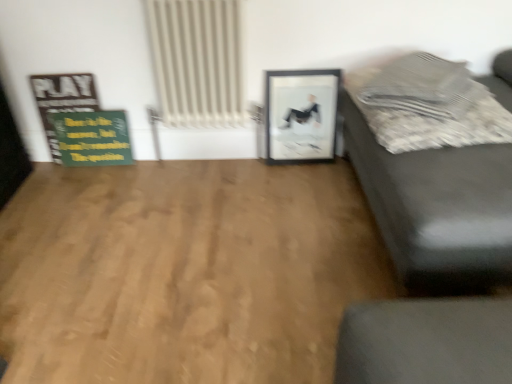
Question: Does matte black couch at right have a larger size compared to white textured radiator at upper center?

Choices:
 (A) yes
 (B) no

Answer: (A)

Question: Is matte black couch at right aimed at white textured radiator at upper center?

Choices:
 (A) no
 (B) yes

Answer: (B)

Question: From a real-world perspective, is matte black couch at right on top of white textured radiator at upper center?

Choices:
 (A) yes
 (B) no

Answer: (A)

Question: Does matte black couch at right have a greater width compared to white textured radiator at upper center?

Choices:
 (A) yes
 (B) no

Answer: (A)

Question: Does matte black couch at right have a lesser height compared to white textured radiator at upper center?

Choices:
 (A) no
 (B) yes

Answer: (A)

Question: Considering the positions of natural wood floor at center and wooden signboard at left in the image, is natural wood floor at center taller or shorter than wooden signboard at left?

Choices:
 (A) short
 (B) tall

Answer: (A)

Question: Is natural wood floor at center in front of or behind wooden signboard at left in the image?

Choices:
 (A) behind
 (B) front

Answer: (B)

Question: Is natural wood floor at center bigger or smaller than wooden signboard at left?

Choices:
 (A) big
 (B) small

Answer: (A)

Question: From the image's perspective, is natural wood floor at center above or below wooden signboard at left?

Choices:
 (A) above
 (B) below

Answer: (B)

Question: From a real-world perspective, is matte black couch at right physically located above or below wooden signboard at left?

Choices:
 (A) above
 (B) below

Answer: (A)

Question: Considering the relative positions of matte black couch at right and wooden signboard at left in the image provided, is matte black couch at right to the left or to the right of wooden signboard at left?

Choices:
 (A) right
 (B) left

Answer: (A)

Question: In terms of width, does matte black couch at right look wider or thinner when compared to wooden signboard at left?

Choices:
 (A) wide
 (B) thin

Answer: (A)

Question: Is matte black couch at right bigger or smaller than wooden signboard at left?

Choices:
 (A) small
 (B) big

Answer: (B)

Question: Which is correct: textured gray pillow at upper right is inside natural wood floor at center, or outside of it?

Choices:
 (A) inside
 (B) outside

Answer: (B)

Question: From their relative heights in the image, would you say textured gray pillow at upper right is taller or shorter than natural wood floor at center?

Choices:
 (A) tall
 (B) short

Answer: (A)